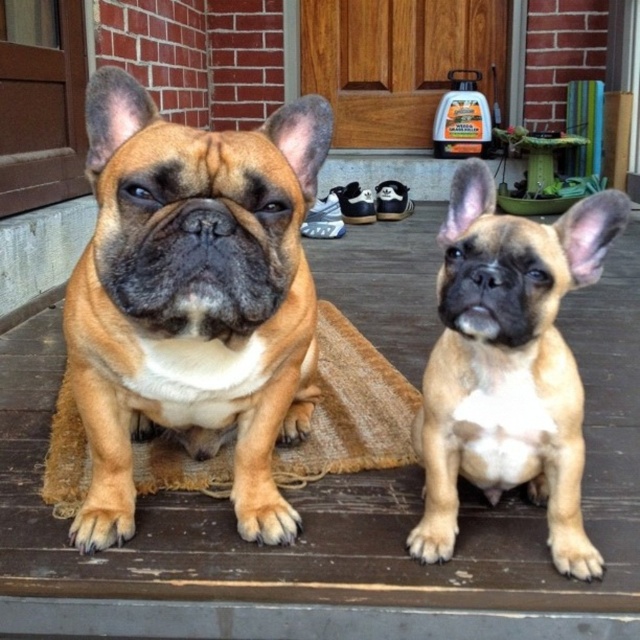
You are a photographer setting up a shot of the two dogs on the porch. You need to ensure that the brown matte dog at center is framed properly. Since the burlap mat at center is wider, which object should you adjust your camera angle to focus on to capture the dog without cropping the mat?

The brown matte dog at center has a lesser width compared to the burlap mat at center, so you should focus on the burlap mat at center to ensure the entire mat is in frame while still capturing the dog.